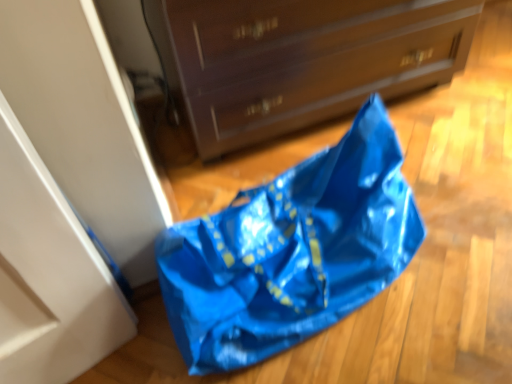
Question: From their relative heights in the image, would you say blue plastic bag at lower center is taller or shorter than matte brown chest of drawers at center?

Choices:
 (A) short
 (B) tall

Answer: (A)

Question: In the image, is blue plastic bag at lower center on the left side or the right side of matte brown chest of drawers at center?

Choices:
 (A) left
 (B) right

Answer: (A)

Question: From the image's perspective, is blue plastic bag at lower center located above or below matte brown chest of drawers at center?

Choices:
 (A) below
 (B) above

Answer: (A)

Question: In terms of height, does matte brown chest of drawers at center look taller or shorter compared to blue plastic bag at lower center?

Choices:
 (A) tall
 (B) short

Answer: (A)

Question: In the image, is matte brown chest of drawers at center positioned in front of or behind blue plastic bag at lower center?

Choices:
 (A) front
 (B) behind

Answer: (B)

Question: Considering the positions of point (313, 109) and point (247, 322), is point (313, 109) closer or farther from the camera than point (247, 322)?

Choices:
 (A) farther
 (B) closer

Answer: (A)

Question: In the image, is matte brown chest of drawers at center on the left side or the right side of blue plastic bag at lower center?

Choices:
 (A) left
 (B) right

Answer: (B)